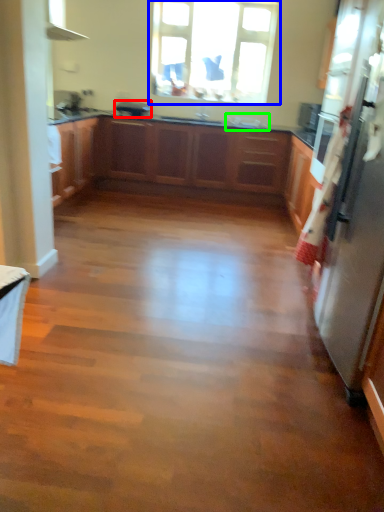
Question: Based on their relative distances, which object is nearer to appliance (highlighted by a red box)? Choose from window (highlighted by a blue box) and sink (highlighted by a green box).

Choices:
 (A) window
 (B) sink

Answer: (A)